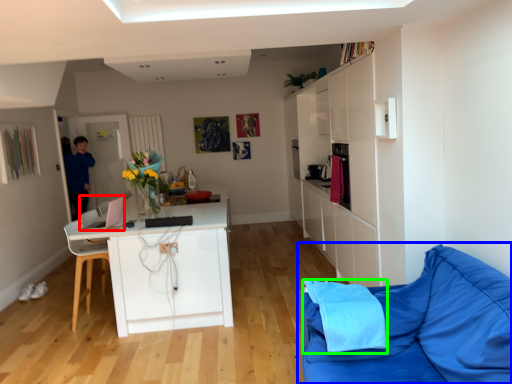
Question: Considering the real-world distances, which object is farthest from appliance (highlighted by a red box)? studio couch (highlighted by a blue box) or material (highlighted by a green box)?

Choices:
 (A) studio couch
 (B) material

Answer: (A)